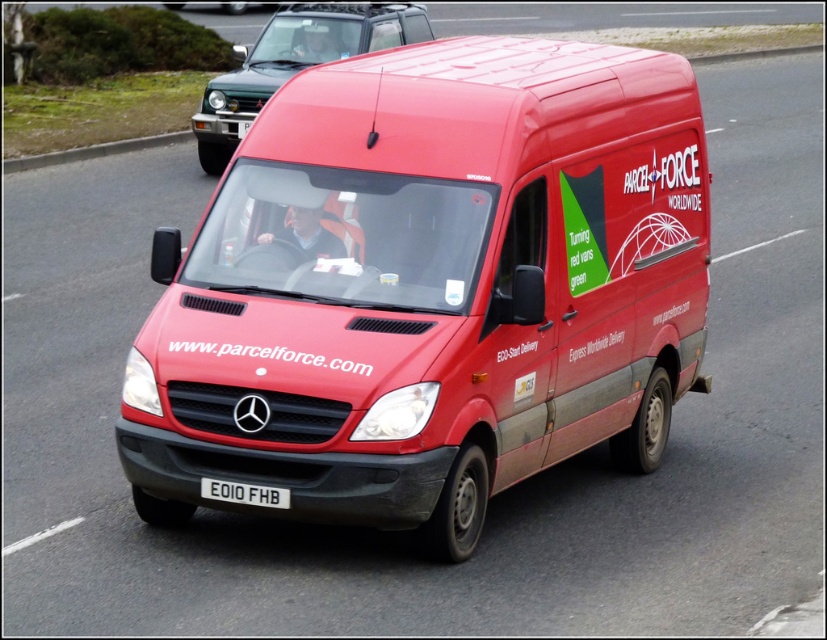
Question: Considering the real-world distances, which object is closest to the matte red van at center?

Choices:
 (A) metallic green suv at upper left
 (B) white metallic license plate at center

Answer: (B)

Question: Which point is closer to the camera taking this photo?

Choices:
 (A) (300, 45)
 (B) (223, 481)

Answer: (B)

Question: Which point is farther from the camera taking this photo?

Choices:
 (A) (338, 52)
 (B) (218, 492)
 (C) (703, 289)

Answer: (A)

Question: Can you confirm if matte red van at center is smaller than white metallic license plate at center?

Choices:
 (A) no
 (B) yes

Answer: (A)

Question: Is metallic green suv at upper left bigger than white metallic license plate at center?

Choices:
 (A) yes
 (B) no

Answer: (A)

Question: Is matte red van at center positioned at the back of white metallic license plate at center?

Choices:
 (A) no
 (B) yes

Answer: (A)